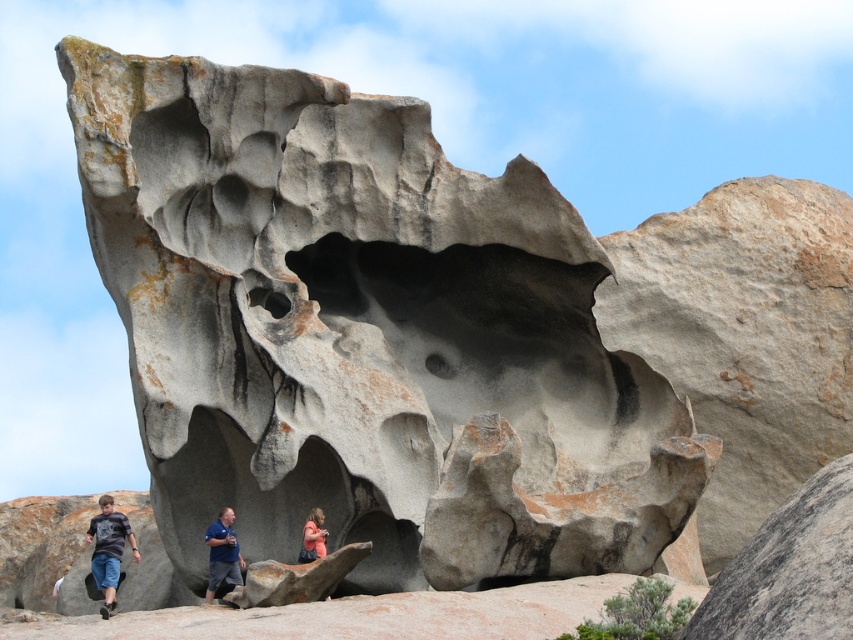
Question: Can you confirm if dark gray t-shirt at lower left is positioned to the right of blue shirt at center?

Choices:
 (A) yes
 (B) no

Answer: (B)

Question: Which point is farther to the camera?

Choices:
 (A) (117, 568)
 (B) (279, 412)
 (C) (309, 513)

Answer: (A)

Question: Among these points, which one is nearest to the camera?

Choices:
 (A) (224, 509)
 (B) (306, 532)
 (C) (334, 493)

Answer: (B)

Question: Which of the following is the closest to the observer?

Choices:
 (A) gray rough rock at center
 (B) dark gray t-shirt at lower left
 (C) blue denim jeans at center
 (D) pink fabric at center

Answer: (B)

Question: Can you confirm if blue shirt at center is wider than blue denim jeans at center?

Choices:
 (A) no
 (B) yes

Answer: (B)

Question: Does blue denim jeans at center appear under pink fabric at center?

Choices:
 (A) yes
 (B) no

Answer: (A)